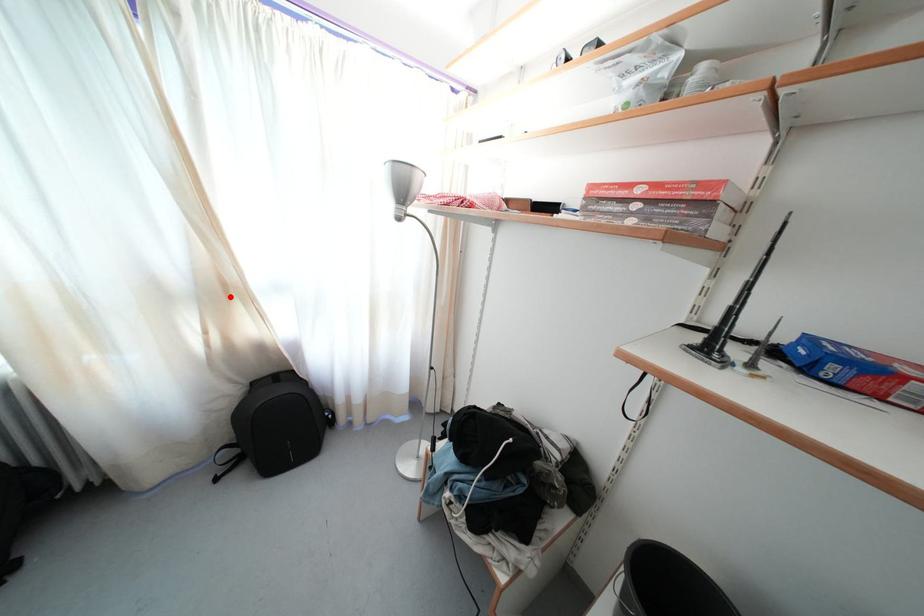
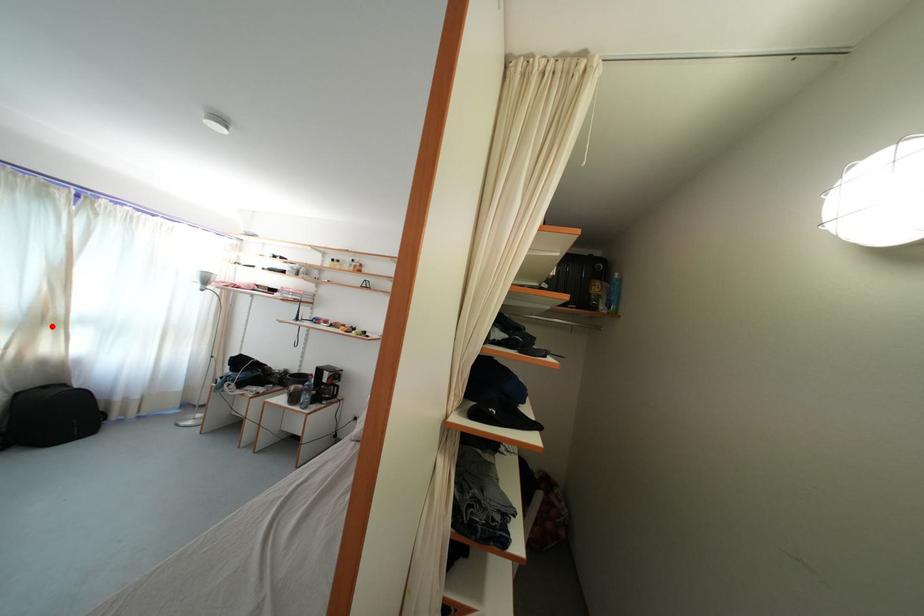
I am providing you with two images of the same scene from different viewpoints. A red point is marked on the first image and another point is marked on the second image. Do the highlighted points in image1 and image2 indicate the same real-world spot?

Yes